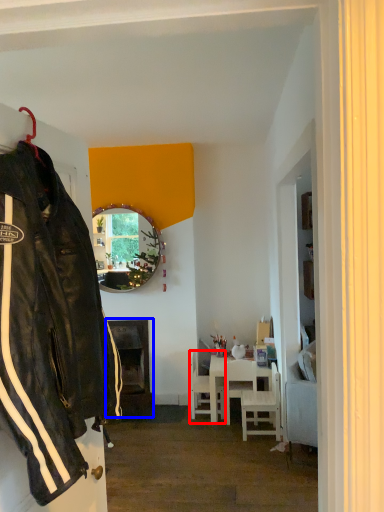
Question: Which point is further to the camera, chair (highlighted by a red box) or fireplace (highlighted by a blue box)?

Choices:
 (A) chair
 (B) fireplace

Answer: (B)